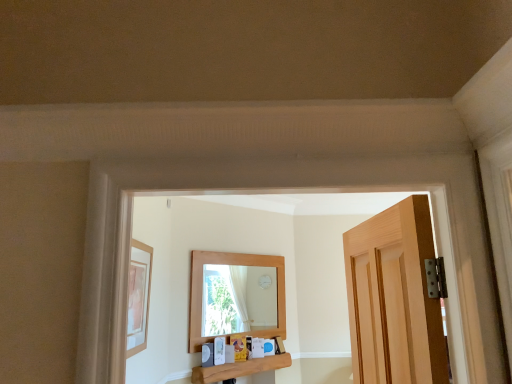
Question: Does wooden shelf at center lie behind wooden picture frame at left?

Choices:
 (A) no
 (B) yes

Answer: (B)

Question: Can you confirm if wooden shelf at center is thinner than wooden picture frame at left?

Choices:
 (A) no
 (B) yes

Answer: (A)

Question: Is wooden shelf at center wider than wooden picture frame at left?

Choices:
 (A) yes
 (B) no

Answer: (A)

Question: Is wooden shelf at center to the left of wooden picture frame at left from the viewer's perspective?

Choices:
 (A) yes
 (B) no

Answer: (B)

Question: Can you confirm if wooden shelf at center is positioned to the right of wooden picture frame at left?

Choices:
 (A) no
 (B) yes

Answer: (B)

Question: Is wooden picture frame at left a part of wooden shelf at center?

Choices:
 (A) no
 (B) yes

Answer: (A)

Question: Can you confirm if wooden picture frame at left is taller than wooden shelf at center?

Choices:
 (A) yes
 (B) no

Answer: (A)

Question: From the image's perspective, does wooden picture frame at left appear lower than wooden shelf at center?

Choices:
 (A) no
 (B) yes

Answer: (A)

Question: Is wooden shelf at center surrounded by wooden picture frame at left?

Choices:
 (A) no
 (B) yes

Answer: (A)

Question: Can you see wooden picture frame at left touching wooden shelf at center?

Choices:
 (A) no
 (B) yes

Answer: (A)

Question: Is wooden picture frame at left positioned behind wooden shelf at center?

Choices:
 (A) yes
 (B) no

Answer: (B)

Question: Is wooden picture frame at left closer to camera compared to wooden shelf at center?

Choices:
 (A) no
 (B) yes

Answer: (B)

Question: Which is correct: wooden picture frame at left is inside wooden shelf at center, or outside of it?

Choices:
 (A) inside
 (B) outside

Answer: (B)